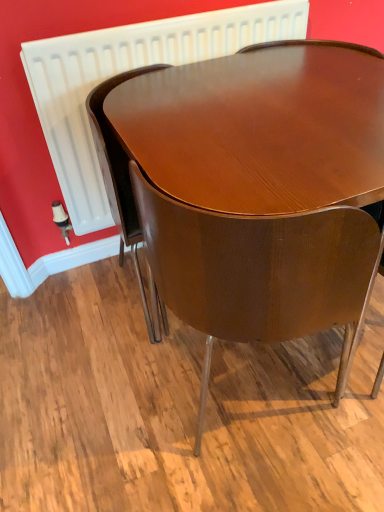
Question: Which direction should I rotate to face glossy wood chair at center, the second chair positioned from the left, — up or down?

Choices:
 (A) up
 (B) down

Answer: (B)

Question: Is glossy wood chair at center, the first chair in the left-to-right sequence, shorter than white plastic radiator at upper center?

Choices:
 (A) no
 (B) yes

Answer: (A)

Question: Is glossy wood chair at center, the 2th chair viewed from the right, closer to the viewer compared to white plastic radiator at upper center?

Choices:
 (A) yes
 (B) no

Answer: (A)

Question: Is glossy wood chair at center, the first chair in the left-to-right sequence, at the left side of white plastic radiator at upper center?

Choices:
 (A) no
 (B) yes

Answer: (B)

Question: From a real-world perspective, is glossy wood chair at center, the 2th chair viewed from the right, under white plastic radiator at upper center?

Choices:
 (A) no
 (B) yes

Answer: (B)

Question: From the image's perspective, would you say glossy wood chair at center, the first chair in the left-to-right sequence, is positioned over white plastic radiator at upper center?

Choices:
 (A) yes
 (B) no

Answer: (B)

Question: Would you say glossy wood chair at center, the 2th chair viewed from the right, is outside white plastic radiator at upper center?

Choices:
 (A) yes
 (B) no

Answer: (A)

Question: Are glossy wood chair at center, the second chair positioned from the left, and glossy wood chair at center, the 2th chair viewed from the right, far apart?

Choices:
 (A) yes
 (B) no

Answer: (B)

Question: Is glossy wood chair at center, the second chair positioned from the left, facing away from glossy wood chair at center, the first chair in the left-to-right sequence?

Choices:
 (A) no
 (B) yes

Answer: (A)

Question: Considering the relative sizes of glossy wood chair at center, which appears as the first chair when viewed from the right, and glossy wood chair at center, the 2th chair viewed from the right, in the image provided, is glossy wood chair at center, which appears as the first chair when viewed from the right, shorter than glossy wood chair at center, the 2th chair viewed from the right,?

Choices:
 (A) no
 (B) yes

Answer: (A)

Question: Is glossy wood chair at center, the second chair positioned from the left, to the right of glossy wood chair at center, the 2th chair viewed from the right, from the viewer's perspective?

Choices:
 (A) no
 (B) yes

Answer: (B)

Question: Considering the relative sizes of glossy wood chair at center, which appears as the first chair when viewed from the right, and glossy wood chair at center, the 2th chair viewed from the right, in the image provided, is glossy wood chair at center, which appears as the first chair when viewed from the right, thinner than glossy wood chair at center, the 2th chair viewed from the right,?

Choices:
 (A) no
 (B) yes

Answer: (A)

Question: Does glossy wood chair at center, the second chair positioned from the left, appear on the left side of glossy wood chair at center, the first chair in the left-to-right sequence?

Choices:
 (A) yes
 (B) no

Answer: (B)

Question: Can you confirm if white plastic radiator at upper center is positioned to the right of glossy wood chair at center, the 2th chair viewed from the right?

Choices:
 (A) no
 (B) yes

Answer: (B)